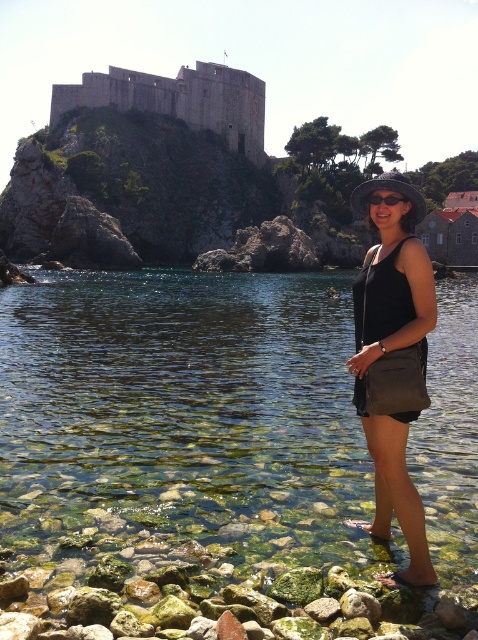
Consider the image. You are a snorkeler preparing to dive into the clear glassy water at center. You see the black plastic goggles at center. Where are the goggles located relative to the water?

The black plastic goggles at center are positioned above the clear glassy water at center since the water is under the goggles.

You are standing at the edge of the rocky shoreline in the coastal scene. You see a black fabric dress at lower right. Where exactly is the black fabric dress located in relation to the point marked by coordinates point [387,356]?

The black fabric dress at lower right is represented by point [387,356].

Consider the image. You are a photographer trying to capture a photo of the black fabric dress at lower right and the black plastic goggles at center. You want to ensure both are in the frame without moving either object. Given the distance between them, what is the minimum focal length your camera lens should have to include both in the shot?

The minimum focal length required depends on the camera sensor size and desired framing. However, since the distance between the black fabric dress at lower right and the black plastic goggles at center is 6.53 meters, a wider angle lens would be necessary to capture both objects in the same frame without moving them.